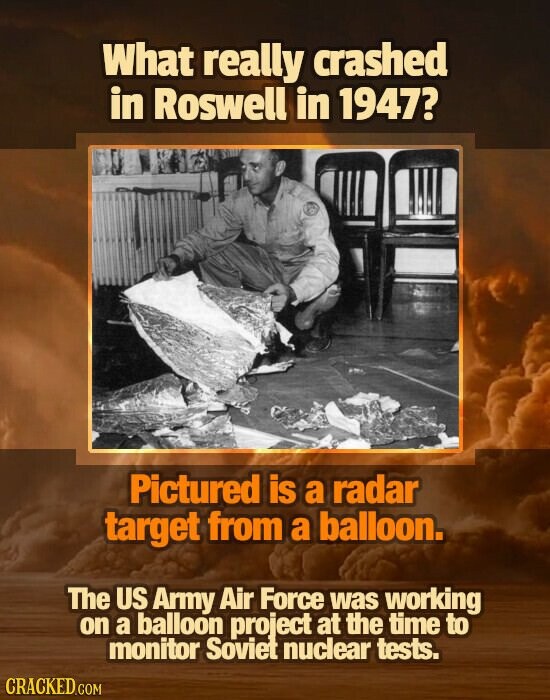
Locate an element on the screen. The image size is (550, 700). cradle is located at coordinates (148, 220).